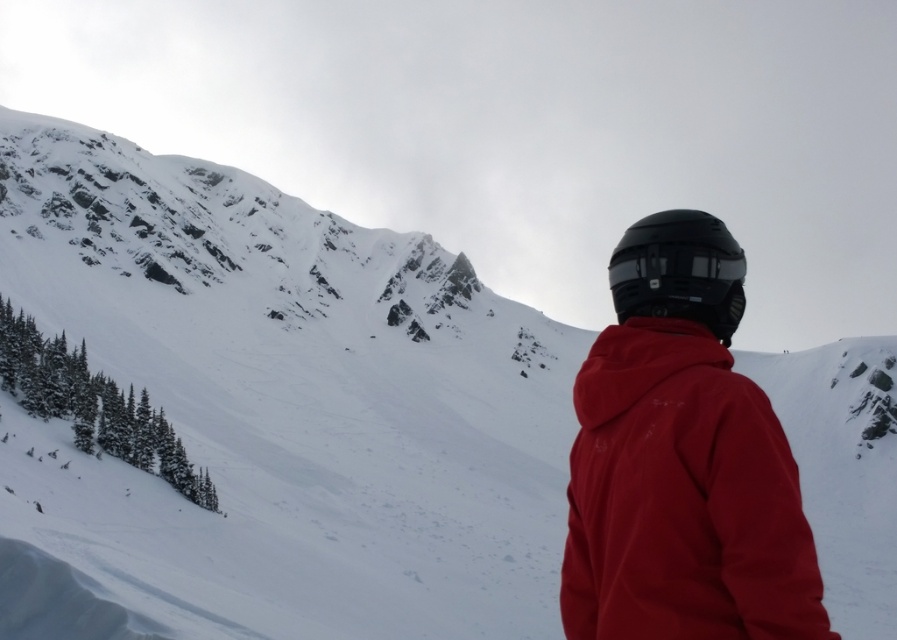
From the picture: Who is more distant from viewer, (778, 428) or (685, 296)?

The point (685, 296) is more distant.

Is point (725, 490) positioned after point (616, 280)?

No, (725, 490) is closer to viewer.

Identify the location of matte red jacket at center. The height and width of the screenshot is (640, 897). (682, 497).

Is black matte helmet at center further to the viewer compared to black matte helmet at upper center?

No.

Between point (671, 257) and point (699, 289), which one is positioned in front?

Point (699, 289) is in front.

Which is behind, point (745, 259) or point (623, 273)?

Point (623, 273)

The image size is (897, 640). What are the coordinates of `black matte helmet at center` in the screenshot? It's located at (678, 269).

Is matte red jacket at center smaller than black matte helmet at upper center?

Incorrect, matte red jacket at center is not smaller in size than black matte helmet at upper center.

Does matte red jacket at center appear under black matte helmet at upper center?

Correct, matte red jacket at center is located below black matte helmet at upper center.

Is point (713, 483) farther from camera compared to point (699, 248)?

No, it is in front of (699, 248).

Find the location of a particular element. matte red jacket at center is located at coordinates (682, 497).